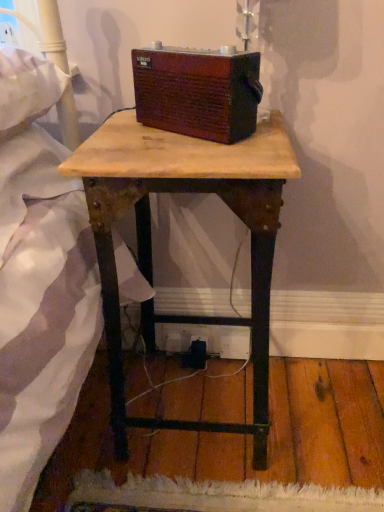
Where is `vacant space situated above wooden table at center (from a real-world perspective)`? vacant space situated above wooden table at center (from a real-world perspective) is located at coordinates (175, 136).